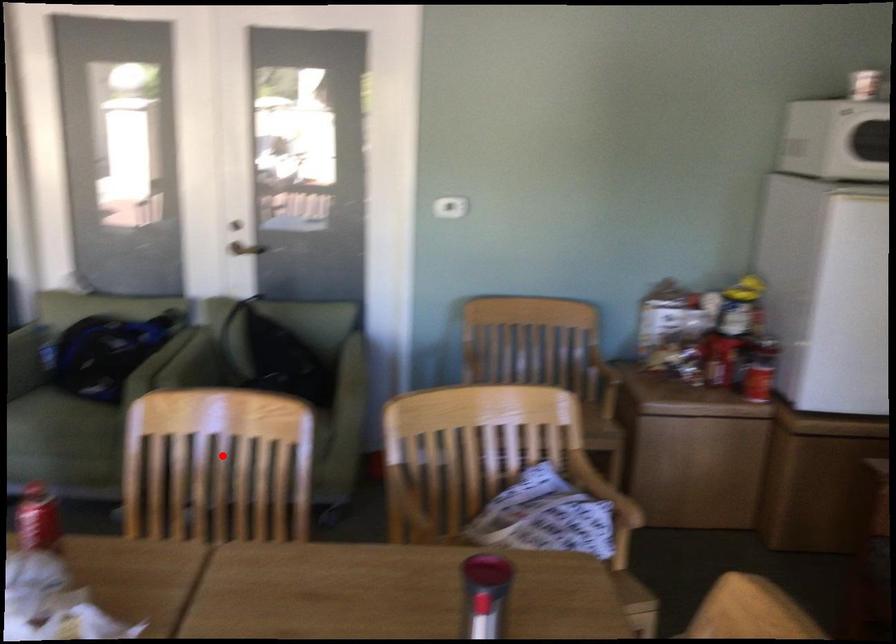
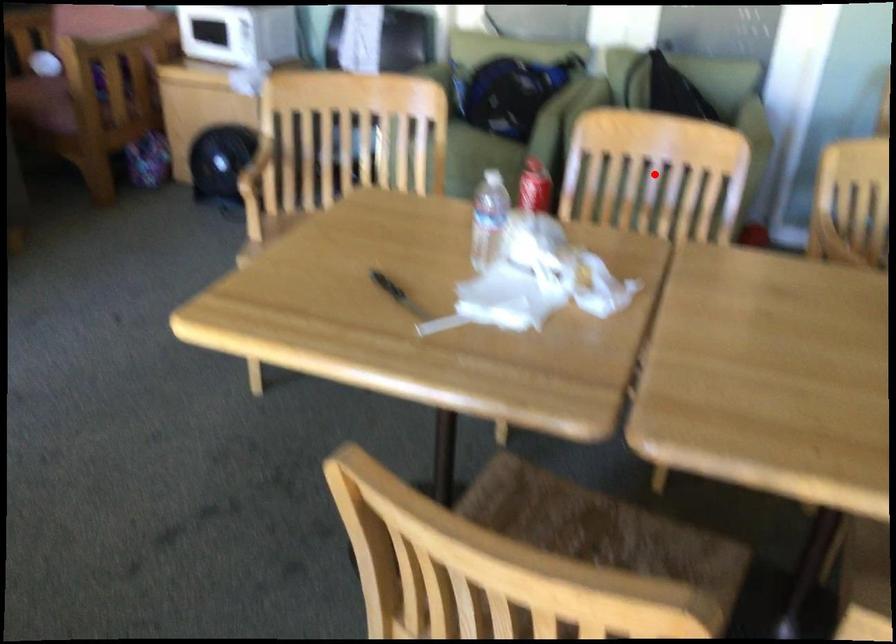
I am providing you with two images of the same scene from different viewpoints. A red point is marked on the first image and another point is marked on the second image. Does the point marked in image1 correspond to the same location as the one in image2?

Yes